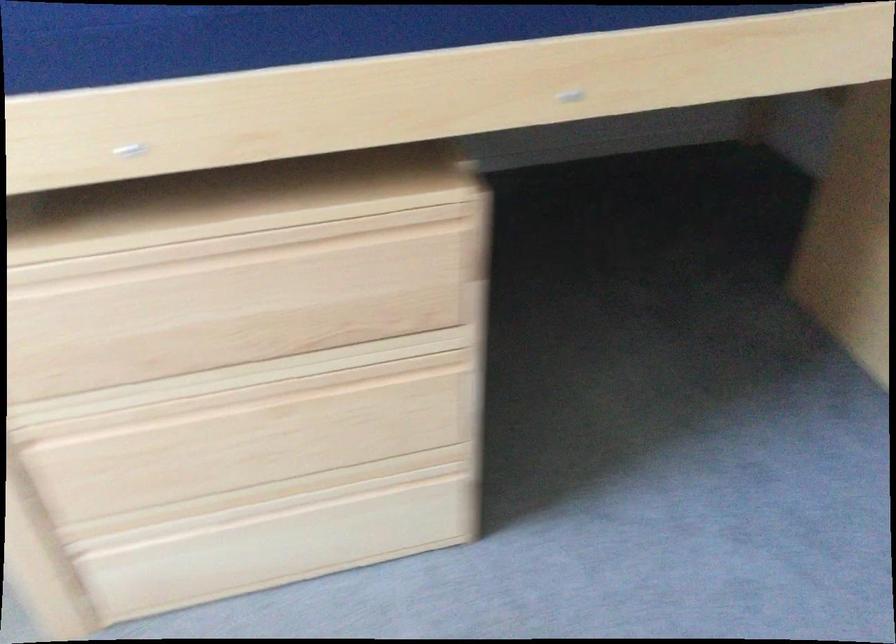
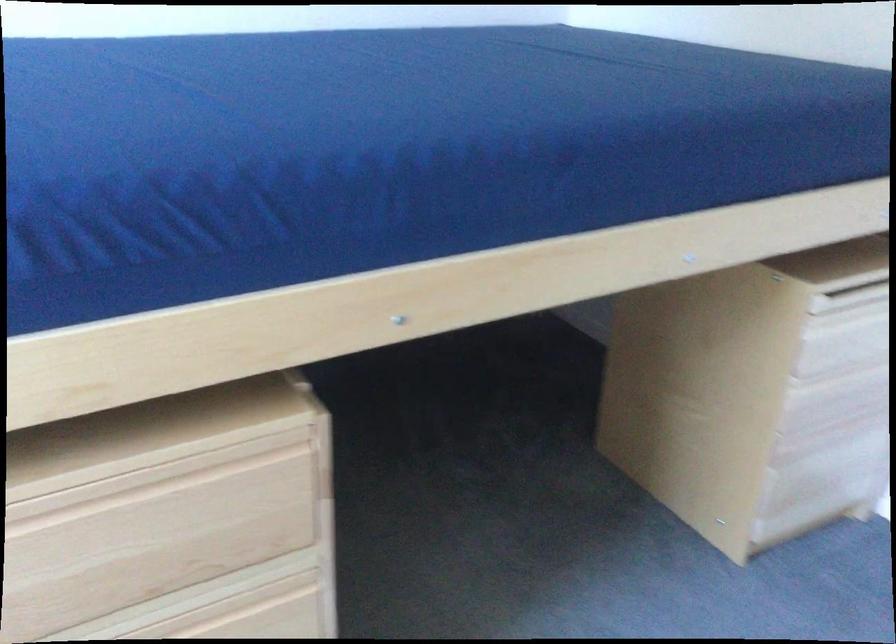
Where in the second image is the point corresponding to point 406,383 from the first image?

(253, 614)